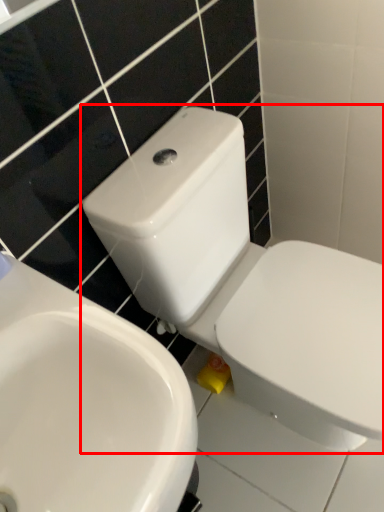
Question: Where is toilet (annotated by the red box) located in relation to sink in the image?

Choices:
 (A) left
 (B) right

Answer: (B)